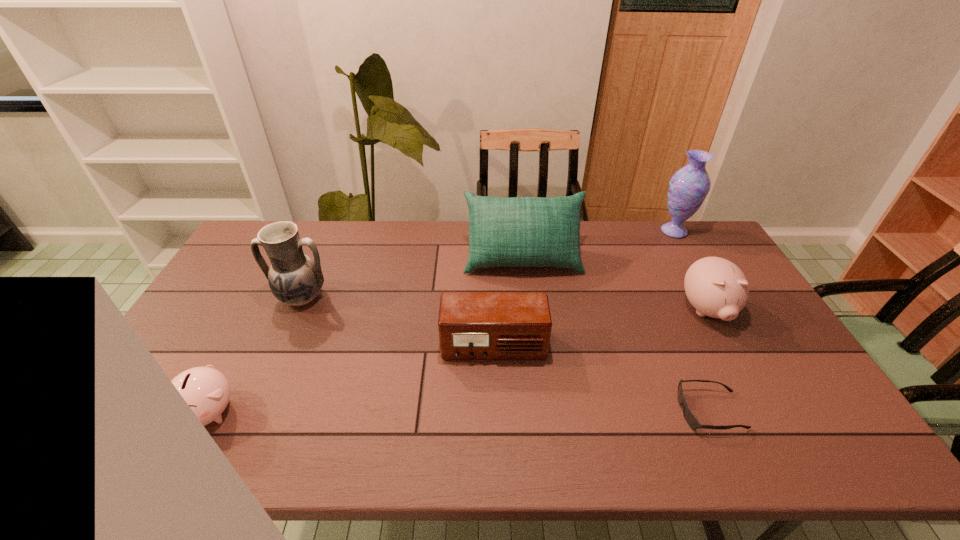
Identify the location of vacant region at the right edge. The image size is (960, 540). (753, 306).

Find the location of a particular element. This screenshot has width=960, height=540. blank space at the far left corner of the desktop is located at coordinates (250, 234).

The width and height of the screenshot is (960, 540). In the image, there is a desktop. Find the location of `vacant space at the far right corner`. vacant space at the far right corner is located at coordinates (702, 256).

Image resolution: width=960 pixels, height=540 pixels. What are the coordinates of `empty space that is in between the cushion and the sunglasses` in the screenshot? It's located at (616, 335).

Locate an element on the screen. The height and width of the screenshot is (540, 960). free space between the cushion and the sunglasses is located at coordinates tap(616, 335).

Find the location of a particular element. This screenshot has width=960, height=540. vacant point located between the pitcher and the radio receiver is located at coordinates (397, 322).

This screenshot has width=960, height=540. I want to click on empty location between the pitcher and the left piggy bank, so click(x=255, y=354).

Find the location of a particular element. This screenshot has height=540, width=960. empty location between the cushion and the left piggy bank is located at coordinates (366, 335).

Where is `empty location between the shortest object and the shorter piggy bank`? The image size is (960, 540). empty location between the shortest object and the shorter piggy bank is located at coordinates (460, 411).

Find the location of `free space between the shortest object and the radio receiver`. free space between the shortest object and the radio receiver is located at coordinates (602, 379).